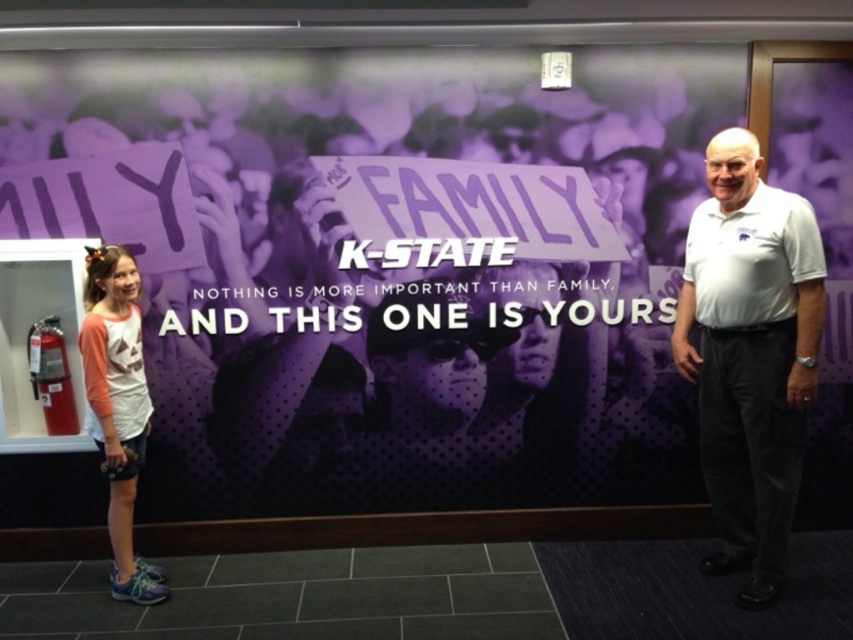
Question: Which point appears closest to the camera in this image?

Choices:
 (A) (788, 356)
 (B) (479, 122)

Answer: (A)

Question: Is purple matte banner at center thinner than white cotton polo shirt at right?

Choices:
 (A) no
 (B) yes

Answer: (A)

Question: Is purple matte banner at center bigger than white cotton polo shirt at right?

Choices:
 (A) no
 (B) yes

Answer: (B)

Question: Which point is farther to the camera?

Choices:
 (A) white cotton polo shirt at right
 (B) matte pink shirt at left

Answer: (B)

Question: Where is white cotton polo shirt at right located in relation to matte pink shirt at left in the image?

Choices:
 (A) below
 (B) above

Answer: (B)

Question: Considering the real-world distances, which object is farthest from the purple matte banner at center?

Choices:
 (A) matte pink shirt at left
 (B) white cotton polo shirt at right

Answer: (B)